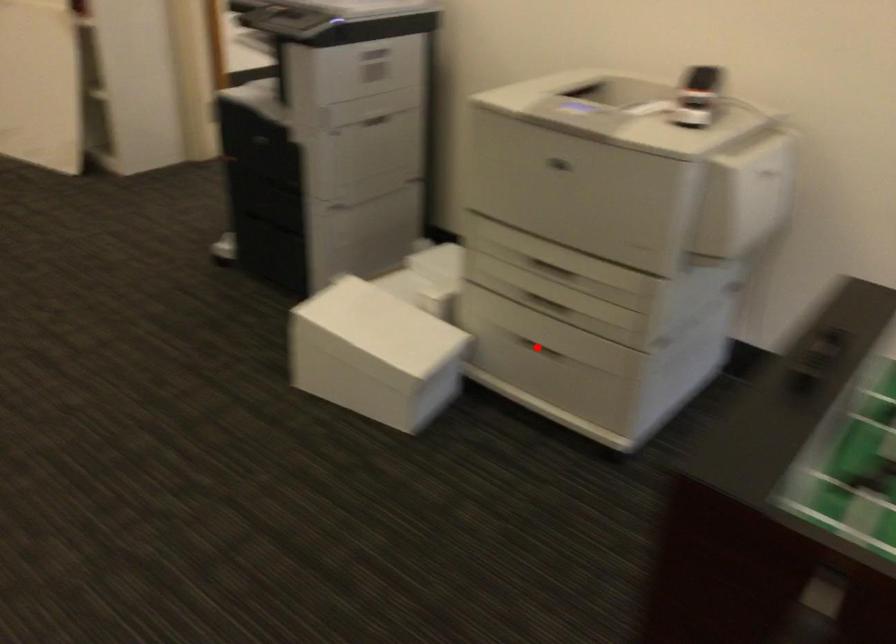
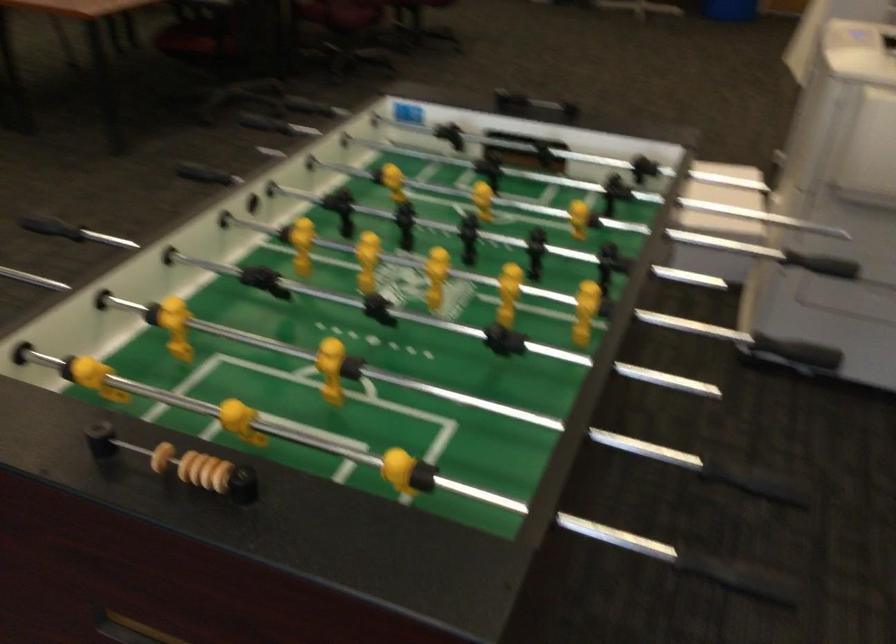
Question: I am providing you with two images of the same scene from different viewpoints. A red point is marked on the first image. Can you still see the location of the red point in image 2?

Choices:
 (A) Yes
 (B) No

Answer: (B)